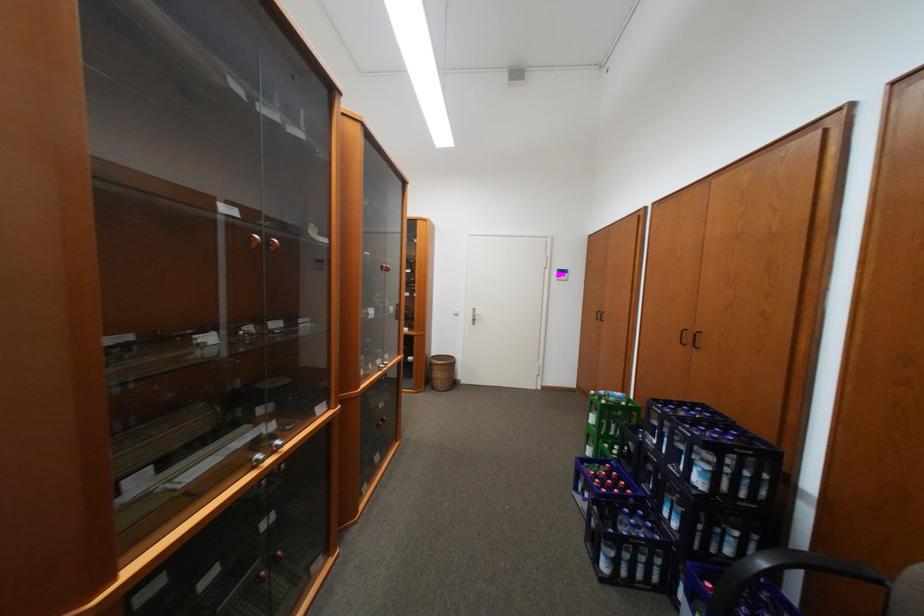
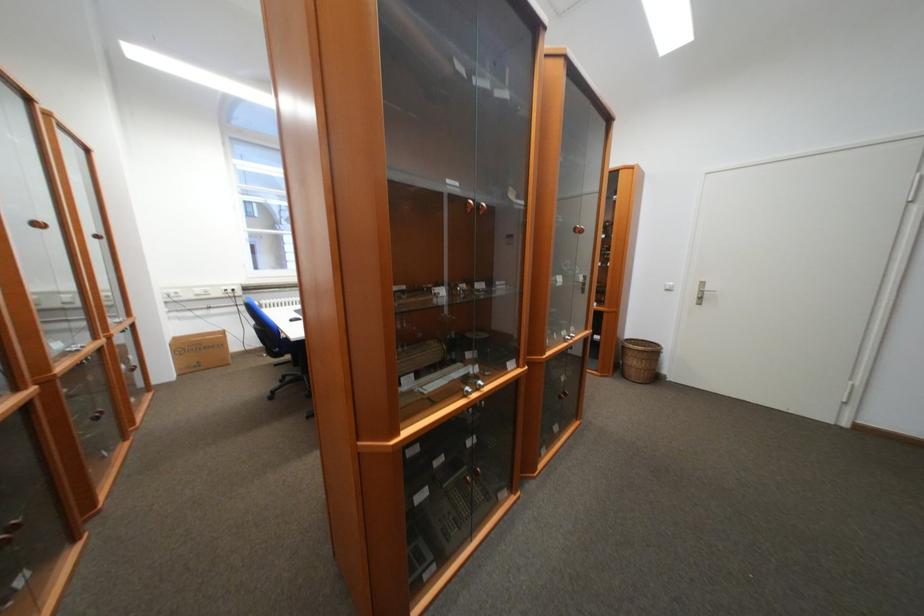
Where in the second image is the point corresponding to (x=483, y=315) from the first image?

(711, 293)